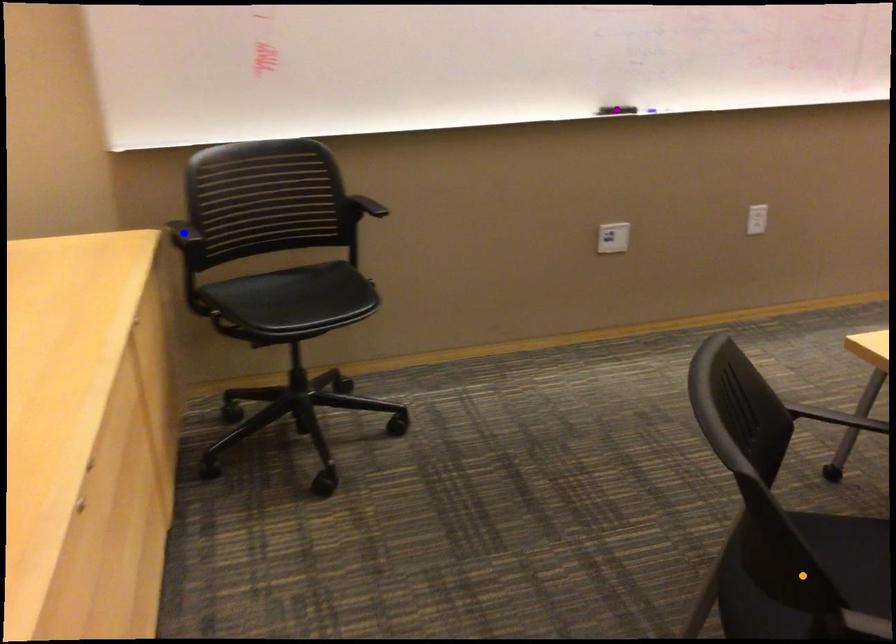
Order these from farthest to nearest:
- blue point
- purple point
- orange point

purple point, blue point, orange point